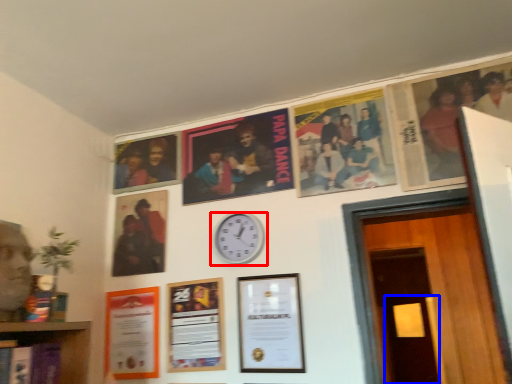
Question: Which object appears closest to the camera in this image, wall clock (highlighted by a red box) or door (highlighted by a blue box)?

Choices:
 (A) wall clock
 (B) door

Answer: (A)